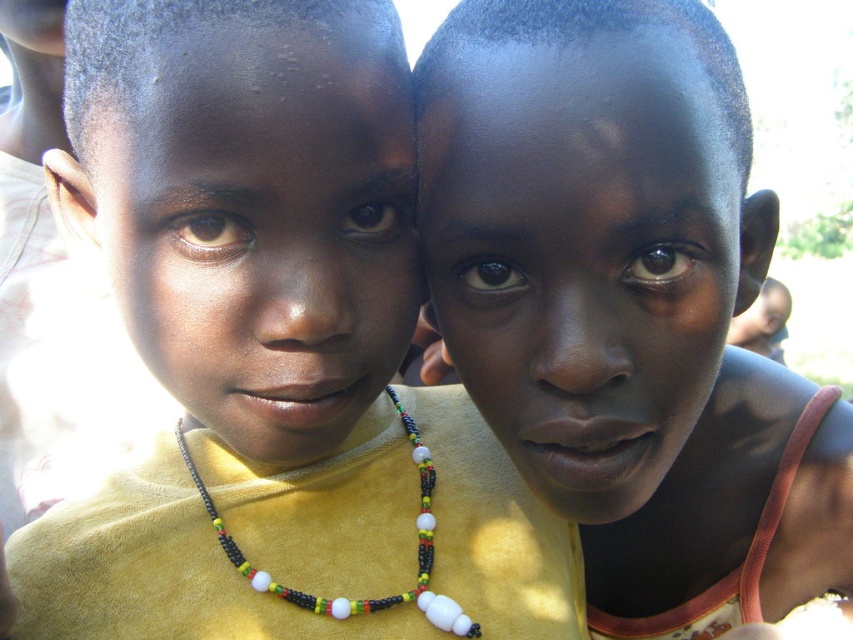
What are the coordinates of the yellow matte shirt at center in the image?

The yellow matte shirt at center is located at coordinates point (274,349).

You are a photographer trying to capture a closeup of the beaded necklace at center without including the yellow matte shirt at center in the frame. Based on their positions, is this possible?

The yellow matte shirt at center is to the left of the beaded necklace at center, so if you position the camera to focus on the beaded necklace at center while avoiding the area to its left, it should be possible to exclude the yellow matte shirt at center from the frame.